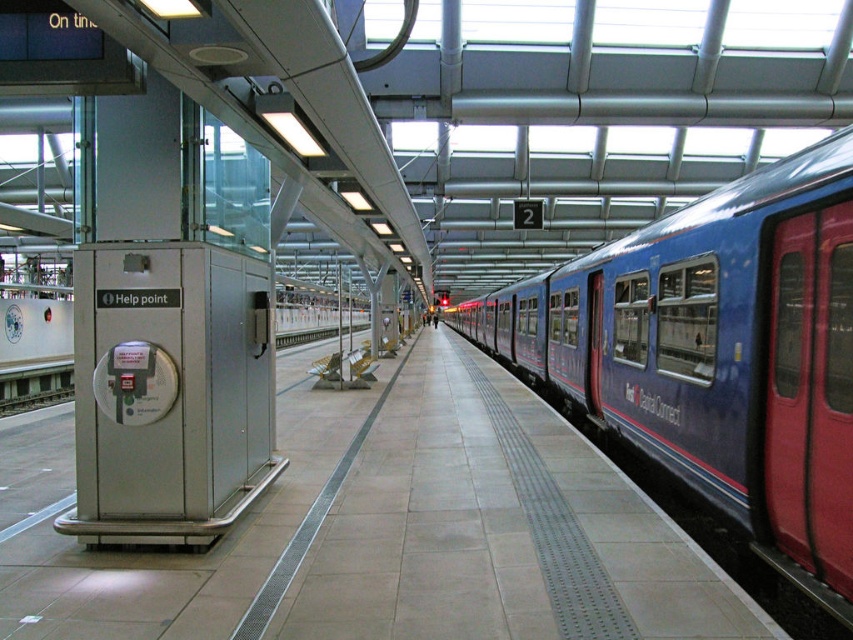
Question: Does smooth concrete platform at center have a lesser width compared to blue metallic train at center?

Choices:
 (A) no
 (B) yes

Answer: (A)

Question: Among these objects, which one is nearest to the camera?

Choices:
 (A) smooth concrete platform at center
 (B) blue metallic train at center

Answer: (B)

Question: Does smooth concrete platform at center come behind blue metallic train at center?

Choices:
 (A) no
 (B) yes

Answer: (B)

Question: Can you confirm if smooth concrete platform at center is wider than blue metallic train at center?

Choices:
 (A) no
 (B) yes

Answer: (B)

Question: Which point is farther to the camera?

Choices:
 (A) (757, 344)
 (B) (345, 394)

Answer: (B)